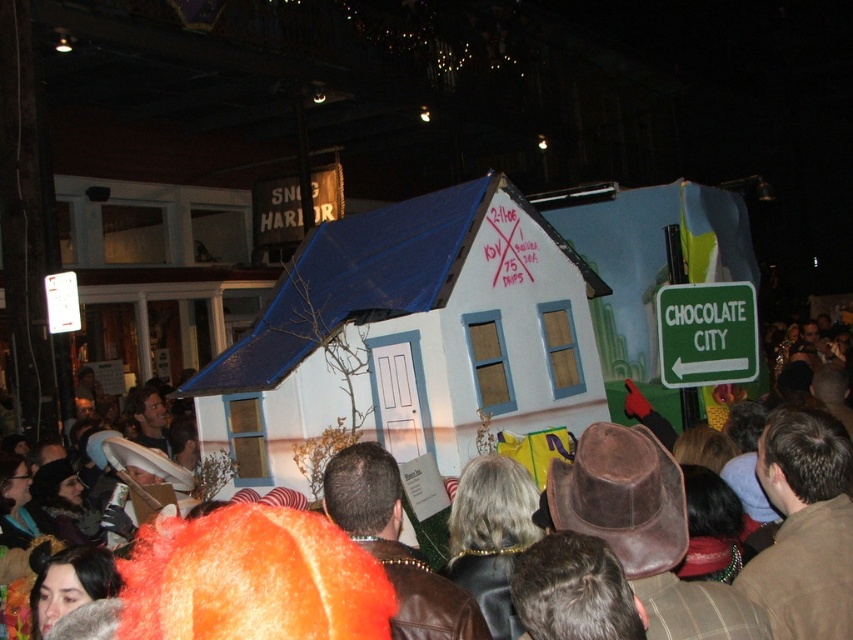
Between point (821, 497) and point (701, 284), which one is positioned in front?

Point (821, 497) is more forward.

This screenshot has width=853, height=640. What do you see at coordinates (788, 540) in the screenshot?
I see `brown leather hat at center` at bounding box center [788, 540].

Who is more distant from viewer, (839, 464) or (743, 321)?

The point (743, 321) is more distant.

You are a GUI agent. You are given a task and a screenshot of the screen. Output one action in this format:
    pyautogui.click(x=<x>, y=<y>)
    Task: Click on the brown leather hat at center
    This screenshot has height=640, width=853.
    Given the screenshot: What is the action you would take?
    pyautogui.click(x=788, y=540)